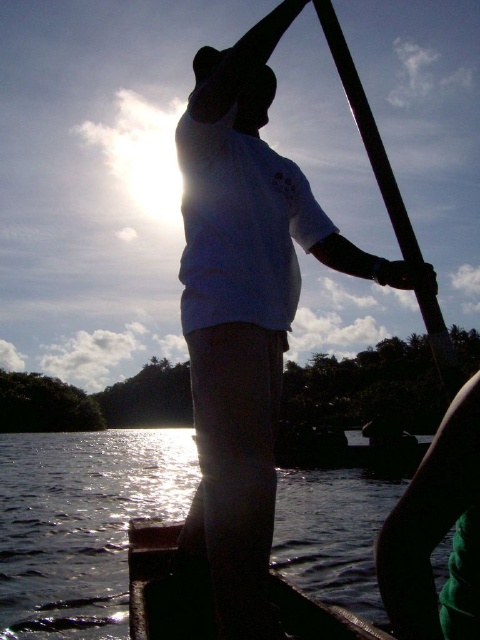
Does white matte shirt at center appear over smooth black pole at upper center?

No, white matte shirt at center is not above smooth black pole at upper center.

Does white matte shirt at center appear on the right side of smooth black pole at upper center?

Incorrect, white matte shirt at center is not on the right side of smooth black pole at upper center.

Is point (274, 340) farther from camera compared to point (429, 336)?

Yes, it is behind point (429, 336).

The height and width of the screenshot is (640, 480). Find the location of `white matte shirt at center`. white matte shirt at center is located at coordinates (245, 308).

Between glistening water at lower left and dark wood boat at center, which one is positioned lower?

glistening water at lower left is lower down.

The width and height of the screenshot is (480, 640). What do you see at coordinates (82, 524) in the screenshot? I see `glistening water at lower left` at bounding box center [82, 524].

Identify the location of glistening water at lower left. This screenshot has width=480, height=640. (82, 524).

Locate an element on the screen. The height and width of the screenshot is (640, 480). white matte shirt at center is located at coordinates (245, 308).

Locate an element on the screen. white matte shirt at center is located at coordinates (245, 308).